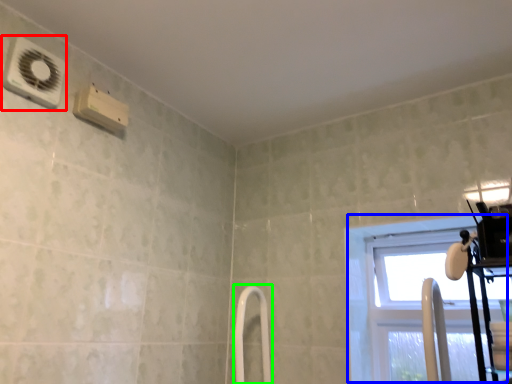
Question: Which object is positioned farthest from air conditioning (highlighted by a red box)? Select from window (highlighted by a blue box) and shower door (highlighted by a green box).

Choices:
 (A) window
 (B) shower door

Answer: (A)